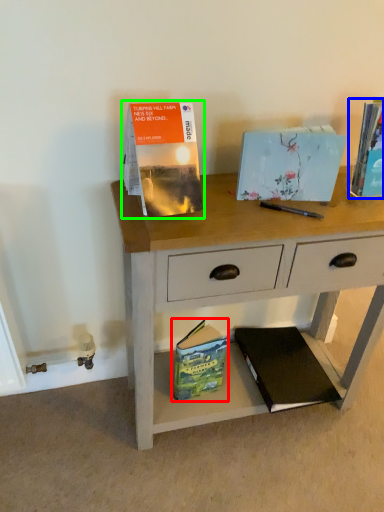
Question: Which object is the farthest from paperback book (highlighted by a red box)? Choose among these: paperback book (highlighted by a blue box) or paperback book (highlighted by a green box).

Choices:
 (A) paperback book
 (B) paperback book

Answer: (A)